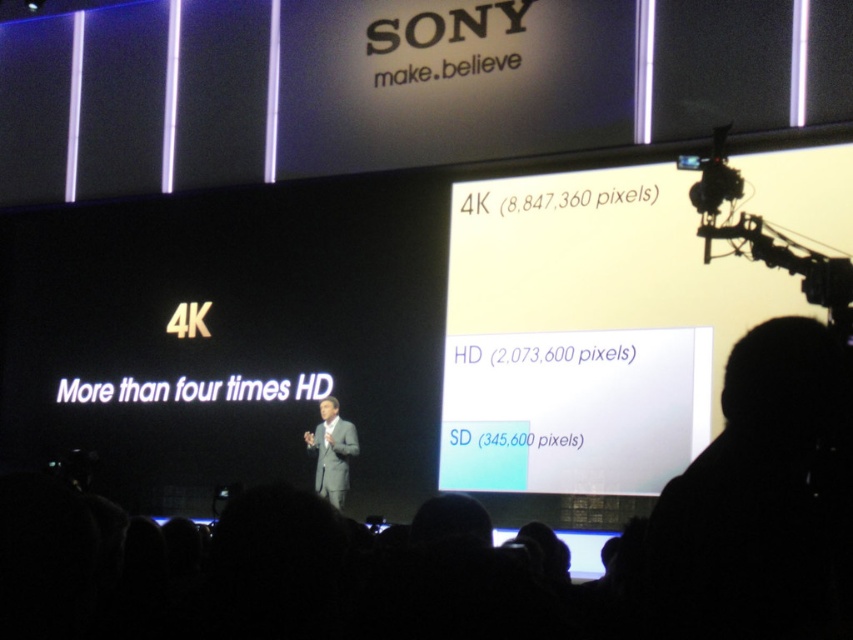
You are a photographer at the Sony event and need to capture a closeup shot of the gray suit at center without the black metal video camera at upper right appearing in the frame. Is this possible based on their sizes?

The black metal video camera at upper right is bigger than gray suit at center. Since the camera is larger, it would likely block the view of the gray suit at center unless positioned strategically to avoid overlap.

You are a stagehand at the Sony event. You need to move the black metal video camera at upper right to a position closer to the speaker. How much distance do you need to move it horizontally to reach the speaker?

The black metal video camera at upper right is 35.96 meters away from the speaker. To move it closer, you need to reduce this distance by moving it horizontally towards the speaker by 35.96 meters.

You are a photographer at the Sony event. You want to capture a clear photo of the gray suit at center without the black metal video camera at upper right blocking the view. Is this possible?

The black metal video camera at upper right is closer to the viewer than the gray suit at center, so it will block the view of the gray suit at center. You need to move to a position where the camera is not in front of the suit.